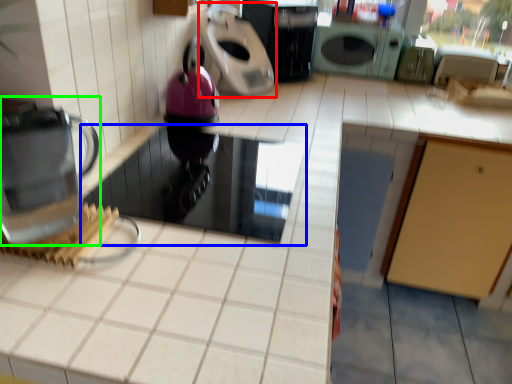
Question: Considering the real-world distances, which object is closest to kitchen appliance (highlighted by a red box)? appliance (highlighted by a blue box) or home appliance (highlighted by a green box).

Choices:
 (A) appliance
 (B) home appliance

Answer: (A)